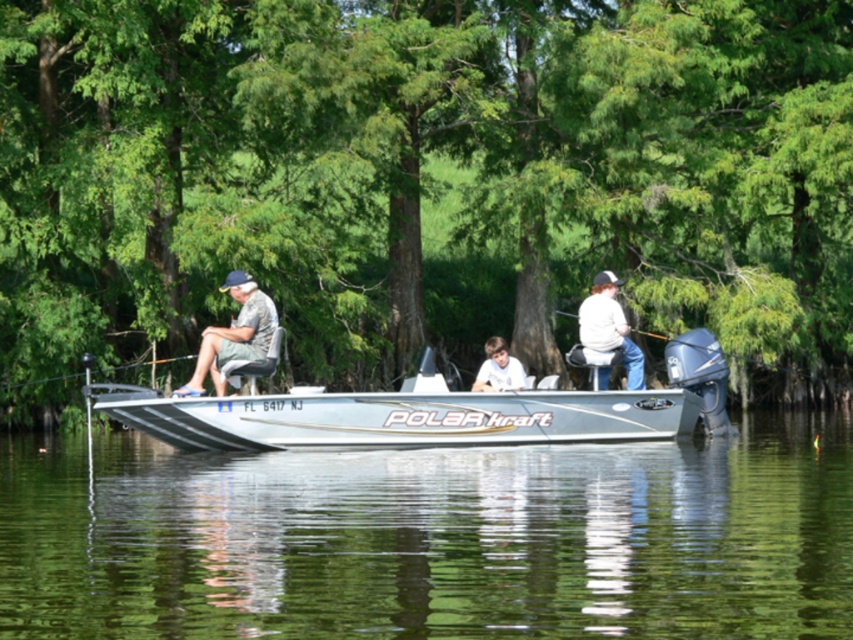
You are standing on the dock and want to place a 60 cm long fishing rod between the silver metallic boat at center and the gray fabric shorts at left. Will it fit without bending?

The silver metallic boat at center and gray fabric shorts at left are 67.47 centimeters apart. Since the fishing rod is 60 cm long, it will fit between them without bending.

Consider the image. You are standing on the dock and want to take a photo of the boat. The camera you have can only focus on objects within 20 meters. Is the point at coordinate point (633, 358) on the boat within the camera focus range?

The distance between point (633, 358) and the camera is 21.18 meters, which is beyond the camera focus range of 20 meters. Therefore, the camera cannot focus on that point.

You are standing on the deck of the motorboat and notice the green leafy tree at center and the gray fabric shorts at left. From your position, which object is located to the right?

The green leafy tree at center is to the right of the gray fabric shorts at left.